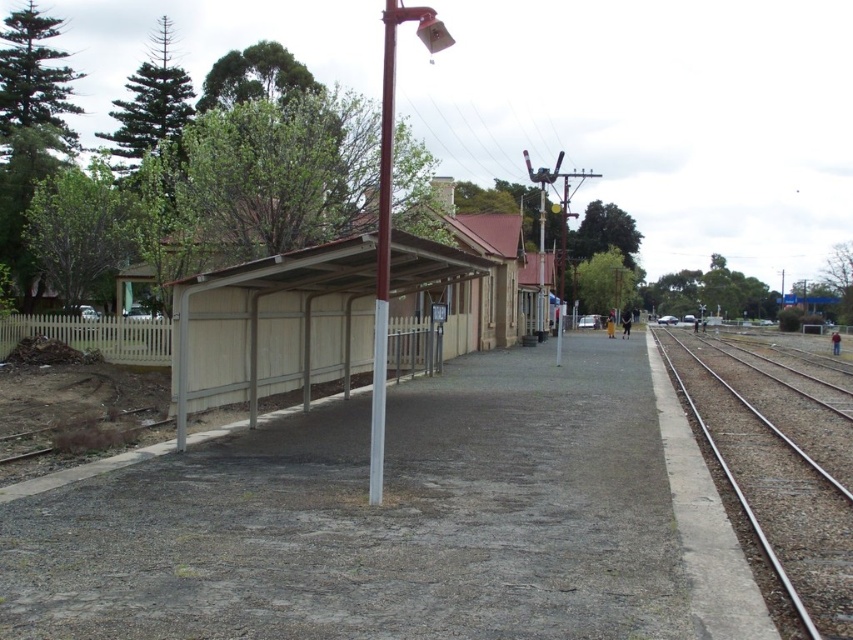
You are a passenger waiting on the platform and see the white glossy pole at center and the metallic pole at center. Which pole is closer to you?

The white glossy pole at center is closer to you because it is in front of the metallic pole at center.

You are standing at the center of the platform and want to locate the white glossy pole at center. According to the coordinates provided, in which direction should you look to find it?

The white glossy pole at center is located at coordinates point [381,253], which means it is positioned slightly to the right and forward from the center point of the platform.